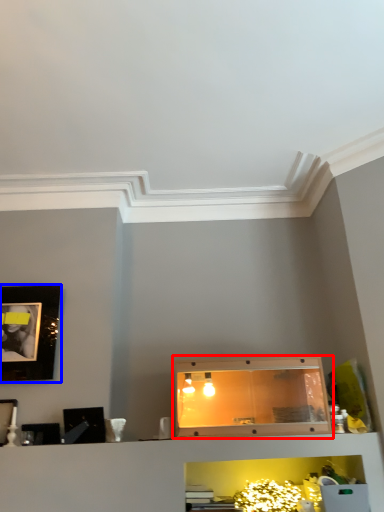
Question: Among these objects, which one is nearest to the camera, cabinetry (highlighted by a red box) or picture frame (highlighted by a blue box)?

Choices:
 (A) cabinetry
 (B) picture frame

Answer: (A)